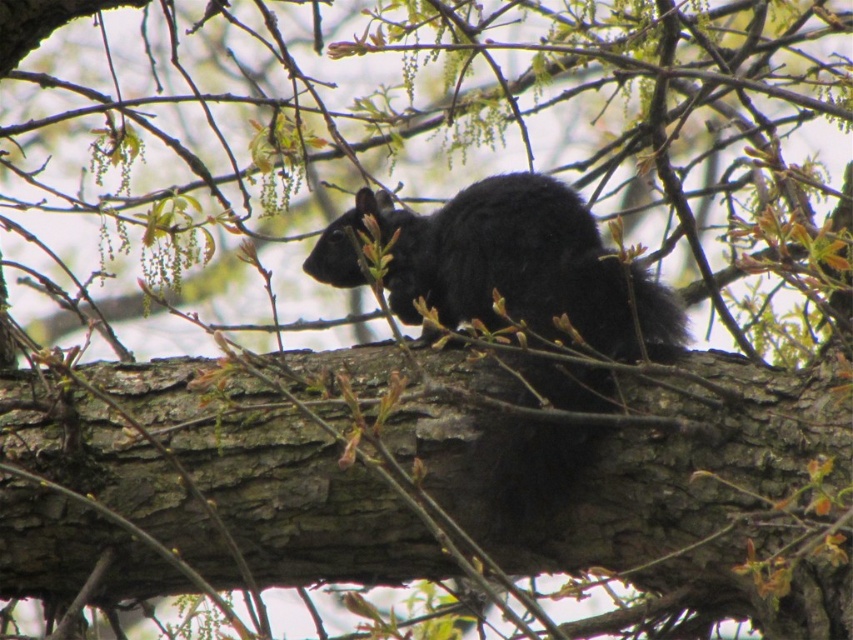
Question: Which point is farther to the camera?

Choices:
 (A) click(x=720, y=481)
 (B) click(x=556, y=460)

Answer: (B)

Question: Is brown rough tree trunk at center behind black furry squirrel at center?

Choices:
 (A) no
 (B) yes

Answer: (A)

Question: Can you confirm if brown rough tree trunk at center is positioned above black furry squirrel at center?

Choices:
 (A) yes
 (B) no

Answer: (B)

Question: Which point appears closest to the camera in this image?

Choices:
 (A) (554, 388)
 (B) (671, 515)

Answer: (B)

Question: Is brown rough tree trunk at center smaller than black furry squirrel at center?

Choices:
 (A) yes
 (B) no

Answer: (A)